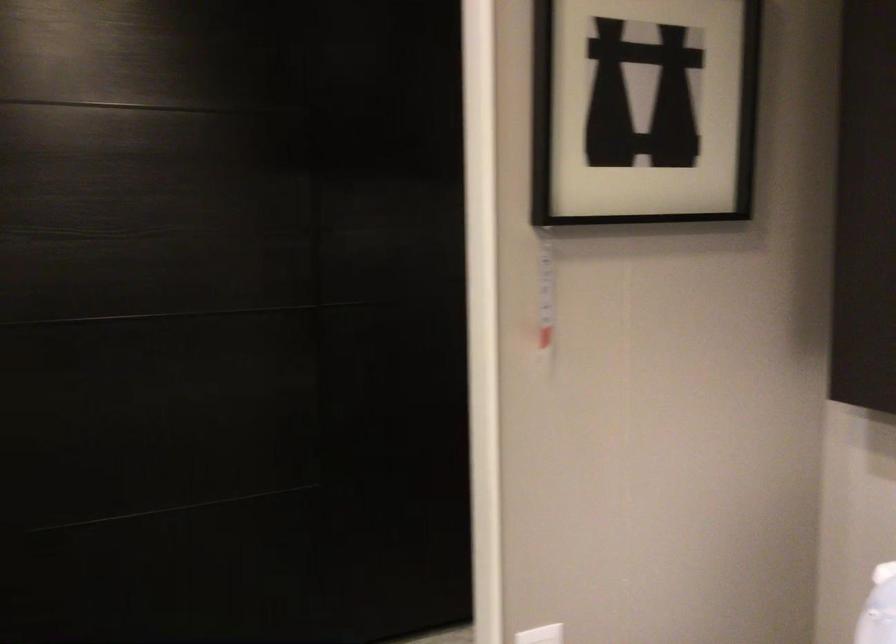
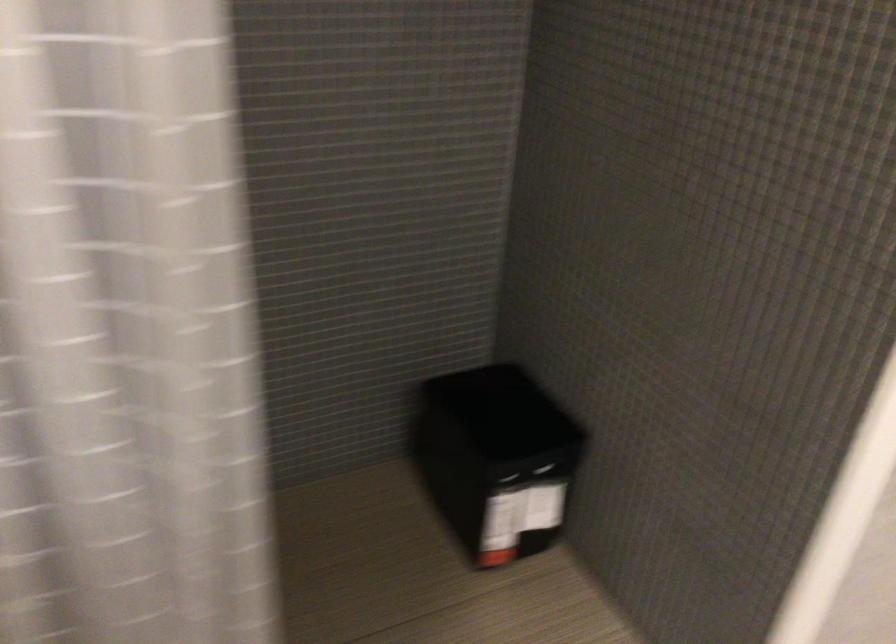
Based on the continuous images, in which direction is the camera rotating?

The rotation direction of the camera is right-down.